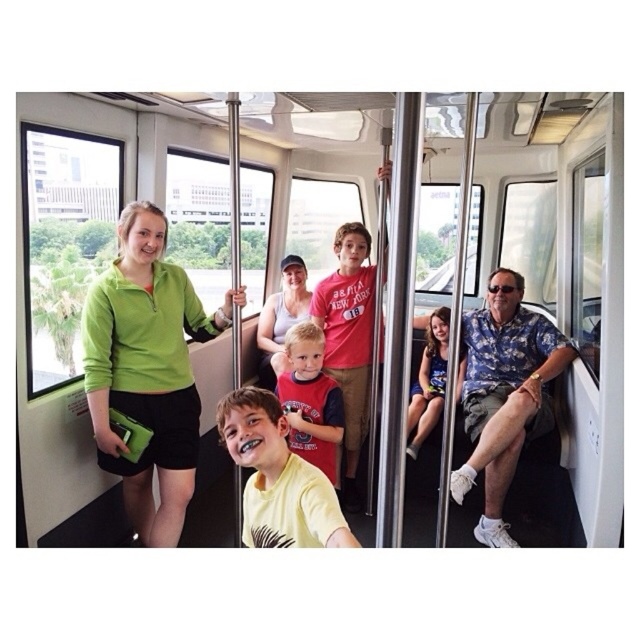
Question: Which is nearer to the green matte jacket at center?

Choices:
 (A) blue denim dress at center
 (B) red cotton shirt at center
 (C) yellow fabric bus at center
 (D) floral print shirt at right

Answer: (B)

Question: Is red cotton shirt at center below blue denim dress at center?

Choices:
 (A) no
 (B) yes

Answer: (B)

Question: Among these points, which one is farthest from the camera?

Choices:
 (A) (419, 390)
 (B) (160, 253)
 (C) (604, 384)

Answer: (A)

Question: Can you confirm if green matte jacket at center is bigger than matte white tank top at center?

Choices:
 (A) no
 (B) yes

Answer: (B)

Question: Which object appears farthest from the camera in this image?

Choices:
 (A) floral print shirt at right
 (B) blue denim dress at center
 (C) matte white tank top at center
 (D) yellow fabric bus at center

Answer: (D)

Question: Can you confirm if red cotton shirt at center is smaller than matte white tank top at center?

Choices:
 (A) yes
 (B) no

Answer: (A)